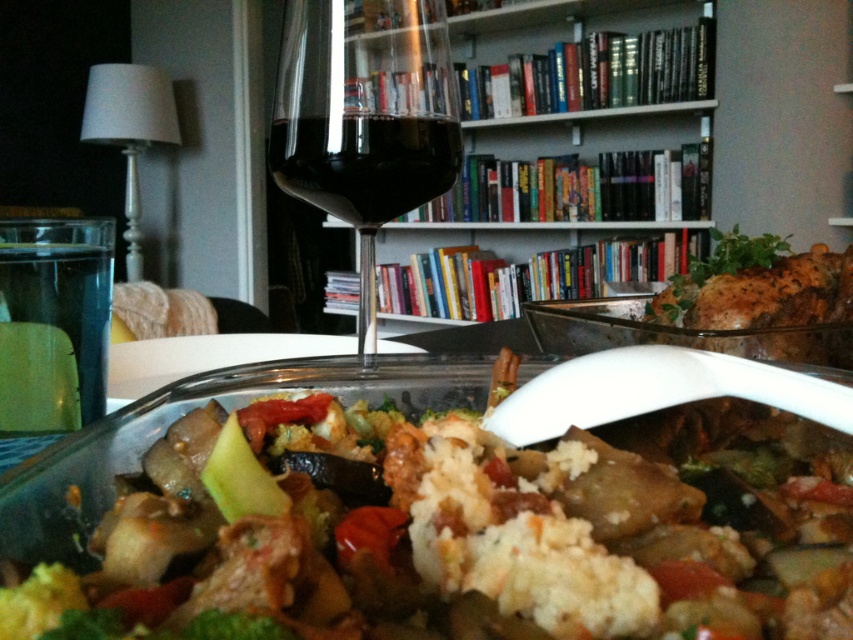
Which is above, transparent glass wine glass at center or dark glass wine at center?

transparent glass wine glass at center

Measure the distance between point (415,48) and camera.

The distance of point (415,48) from camera is 11.89 inches.

Does point (288, 193) come behind point (285, 182)?

Yes, point (288, 193) is behind point (285, 182).

Where is `transparent glass wine glass at center`? transparent glass wine glass at center is located at coordinates point(364,116).

Who is higher up, white creamy rice at center or transparent glass wine glass at center?

transparent glass wine glass at center

Which is more to the right, white creamy rice at center or transparent glass wine glass at center?

From the viewer's perspective, white creamy rice at center appears more on the right side.

What do you see at coordinates (445, 522) in the screenshot? This screenshot has width=853, height=640. I see `white creamy rice at center` at bounding box center [445, 522].

You are a GUI agent. You are given a task and a screenshot of the screen. Output one action in this format:
    pyautogui.click(x=<x>, y=<y>)
    Task: Click on the white creamy rice at center
    The height and width of the screenshot is (640, 853).
    Given the screenshot: What is the action you would take?
    pyautogui.click(x=445, y=522)

Is the position of hardcover books at upper center less distant than that of transparent glass wine glass at center?

No, it is not.

Who is positioned more to the right, hardcover books at upper center or transparent glass wine glass at center?

hardcover books at upper center is more to the right.

Between point (608, 61) and point (364, 301), which one is positioned in front?

Positioned in front is point (364, 301).

You are a GUI agent. You are given a task and a screenshot of the screen. Output one action in this format:
    pyautogui.click(x=<x>, y=<y>)
    Task: Click on the hardcover books at upper center
    
    Given the screenshot: What is the action you would take?
    click(x=584, y=67)